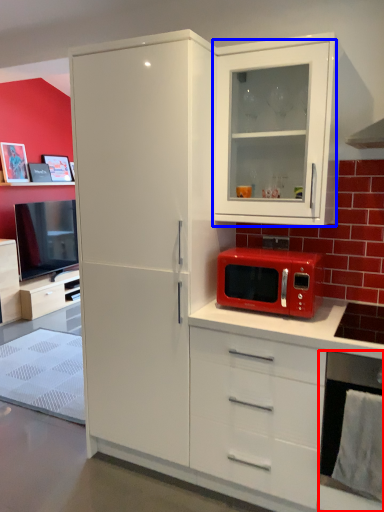
Question: Which of the following is the closest to the observer, appliance (highlighted by a red box) or cabinetry (highlighted by a blue box)?

Choices:
 (A) appliance
 (B) cabinetry

Answer: (A)